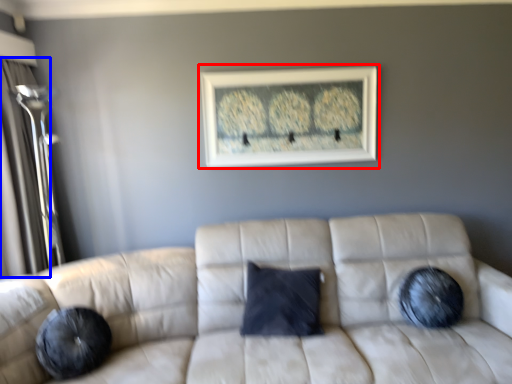
Question: Which object appears closest to the camera in this image, picture frame (highlighted by a red box) or glass door (highlighted by a blue box)?

Choices:
 (A) picture frame
 (B) glass door

Answer: (B)